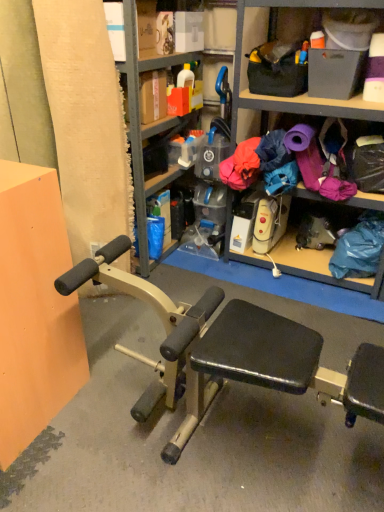
This screenshot has height=512, width=384. What do you see at coordinates (143, 125) in the screenshot? I see `metallic gray bookshelf at upper center` at bounding box center [143, 125].

Where is `metallic gray bookshelf at upper center`? metallic gray bookshelf at upper center is located at coordinates (143, 125).

This screenshot has height=512, width=384. I want to click on purple fabric at center, so click(x=329, y=182).

The width and height of the screenshot is (384, 512). What do you see at coordinates (329, 182) in the screenshot?
I see `purple fabric at center` at bounding box center [329, 182].

The image size is (384, 512). I want to click on metallic gray bookshelf at upper center, so click(x=143, y=125).

Between metallic gray bookshelf at upper center and purple fabric at center, which one appears on the left side from the viewer's perspective?

metallic gray bookshelf at upper center.

Considering the positions of objects metallic gray bookshelf at upper center and purple fabric at center in the image provided, who is in front, metallic gray bookshelf at upper center or purple fabric at center?

metallic gray bookshelf at upper center.

Is point (129, 41) less distant than point (372, 193)?

Yes, point (129, 41) is closer to viewer.

From the image's perspective, is metallic gray bookshelf at upper center located beneath purple fabric at center?

Incorrect, from the image's perspective, metallic gray bookshelf at upper center is higher than purple fabric at center.

From a real-world perspective, is metallic gray bookshelf at upper center positioned above or below purple fabric at center?

Clearly, from a real-world perspective, metallic gray bookshelf at upper center is above purple fabric at center.

In the scene shown: Can you confirm if metallic gray bookshelf at upper center is wider than purple fabric at center?

In fact, metallic gray bookshelf at upper center might be narrower than purple fabric at center.

Based on the photo, who is taller, metallic gray bookshelf at upper center or purple fabric at center?

Standing taller between the two is metallic gray bookshelf at upper center.

Between metallic gray bookshelf at upper center and purple fabric at center, which one has smaller size?

Smaller between the two is purple fabric at center.

Would you say metallic gray bookshelf at upper center contains purple fabric at center?

Actually, purple fabric at center is outside metallic gray bookshelf at upper center.

Is metallic gray bookshelf at upper center far away from purple fabric at center?

No, there isn't a large distance between metallic gray bookshelf at upper center and purple fabric at center.

Is purple fabric at center at the back of metallic gray bookshelf at upper center?

No, metallic gray bookshelf at upper center is not facing the opposite direction of purple fabric at center.

How different are the orientations of metallic gray bookshelf at upper center and purple fabric at center in degrees?

The facing directions of metallic gray bookshelf at upper center and purple fabric at center are 85.3 degrees apart.

This screenshot has height=512, width=384. What are the coordinates of `shelf on the right of metallic gray bookshelf at upper center` in the screenshot? It's located at (329, 182).

Is purple fabric at center to the left or to the right of metallic gray bookshelf at upper center in the image?

Clearly, purple fabric at center is on the right of metallic gray bookshelf at upper center in the image.

Relative to metallic gray bookshelf at upper center, is purple fabric at center in front or behind?

Clearly, purple fabric at center is behind metallic gray bookshelf at upper center.

Which is closer, (338, 179) or (189, 54)?

Clearly, point (338, 179) is closer to the camera than point (189, 54).

From the image's perspective, which is below, purple fabric at center or metallic gray bookshelf at upper center?

From the image's view, purple fabric at center is below.

From a real-world perspective, is purple fabric at center beneath metallic gray bookshelf at upper center?

Yes, from a real-world perspective, purple fabric at center is beneath metallic gray bookshelf at upper center.

Looking at their sizes, would you say purple fabric at center is wider or thinner than metallic gray bookshelf at upper center?

In the image, purple fabric at center appears to be wider than metallic gray bookshelf at upper center.

Considering the sizes of purple fabric at center and metallic gray bookshelf at upper center in the image, is purple fabric at center taller or shorter than metallic gray bookshelf at upper center?

Considering their sizes, purple fabric at center has less height than metallic gray bookshelf at upper center.

Considering the relative sizes of purple fabric at center and metallic gray bookshelf at upper center in the image provided, is purple fabric at center bigger than metallic gray bookshelf at upper center?

Actually, purple fabric at center might be smaller than metallic gray bookshelf at upper center.

Can metallic gray bookshelf at upper center be found inside purple fabric at center?

No, metallic gray bookshelf at upper center is not surrounded by purple fabric at center.

Are purple fabric at center and metallic gray bookshelf at upper center making contact?

No, purple fabric at center is not next to metallic gray bookshelf at upper center.

Is purple fabric at center facing away from metallic gray bookshelf at upper center?

That's not correct — purple fabric at center is not looking away from metallic gray bookshelf at upper center.

How many degrees apart are the facing directions of purple fabric at center and metallic gray bookshelf at upper center?

There is a 85.3-degree angle between the facing directions of purple fabric at center and metallic gray bookshelf at upper center.

Identify the location of shelf below the metallic gray bookshelf at upper center (from the image's perspective). (329, 182).

What are the coordinates of `bookshelf above the purple fabric at center (from a real-world perspective)` in the screenshot? It's located at (143, 125).

Identify the location of bookshelf above the purple fabric at center (from the image's perspective). (143, 125).